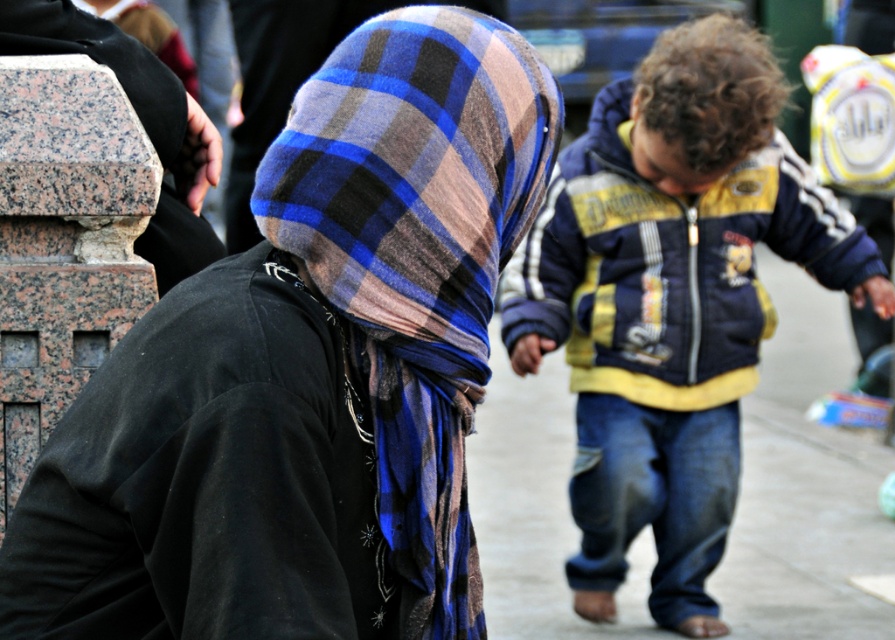
You are a photographer trying to capture the child in the blue and yellow jacket at center and the adult with the plaid wool scarf at center. Which object should you focus on first if you want to photograph the one closer to the camera?

The blue and yellow jacket at center is to the right of the plaid wool scarf at center, so the blue and yellow jacket at center is closer to the camera and should be focused on first.

You are a photographer trying to capture a photo of the blue and yellow jacket at center. You want to focus on the jacket using a camera with a focus point at coordinates 0.5, 0.5. Will the jacket be in focus?

The blue and yellow jacket at center is at point (671, 301), which is close to the camera focus point at (447, 320). Therefore, the jacket should be in focus.

You are a photographer trying to capture a clear shot of the plaid wool scarf at center and the blue and yellow jacket at center. Which object should you focus on first to ensure both are in focus?

The plaid wool scarf at center is further away from the viewer than the blue and yellow jacket at center. To ensure both are in focus, you should focus on the plaid wool scarf at center first, as it is farther away, allowing the blue and yellow jacket at center to remain sharp in the depth of field.